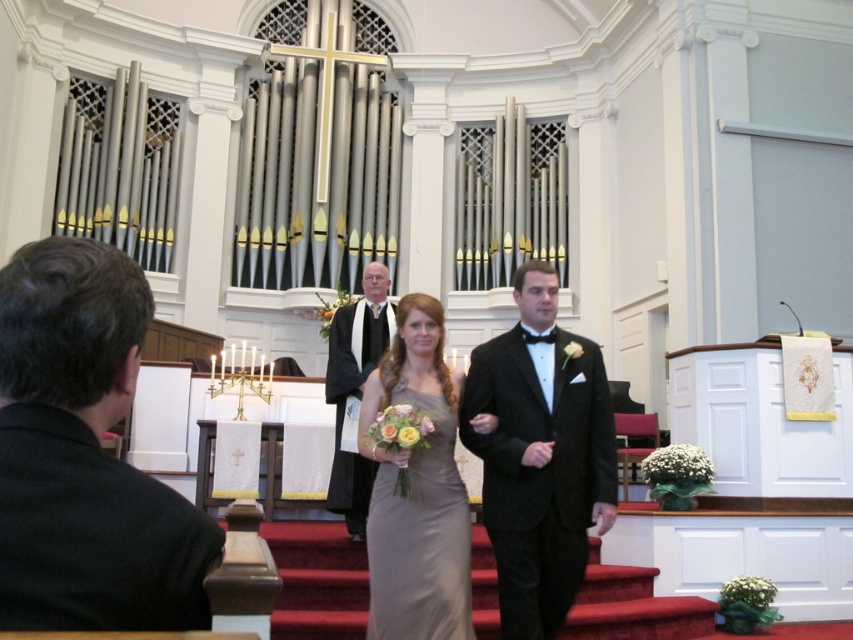
You are a photographer positioned at the back of the church capturing the wedding procession. You notice the black satin tuxedo at center and the white silk robe at center. Which one is closer to your right side?

The black satin tuxedo at center is to the right of the white silk robe at center, so the black satin tuxedo at center is closer to your right side.

You are standing in the church and see two points marked in the image. Which point is closer to you, point (103, 294) or point (447, 474)?

Point (103, 294) is closer to the viewer than point (447, 474).

You are a photographer at the wedding. You need to capture a photo of the satin dress at center and the white silk robe at center. According to the scene description, which one is lower in the image?

The satin dress at center is below white silk robe at center, so the satin dress at center is lower in the image.